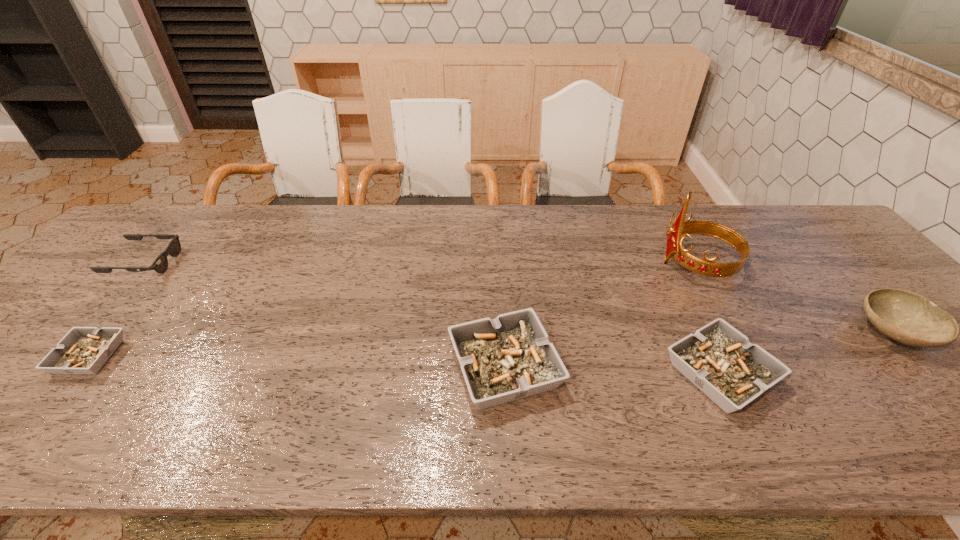
Image resolution: width=960 pixels, height=540 pixels. I want to click on object that is the second nearest to the fourth object from right to left, so click(x=680, y=228).

Select which ashtray appears as the closest to the leftmost ashtray. Please provide its 2D coordinates. Your answer should be formatted as a tuple, i.e. [(x, y)], where the tuple contains the x and y coordinates of a point satisfying the conditions above.

[(508, 358)]

You are a GUI agent. You are given a task and a screenshot of the screen. Output one action in this format:
    pyautogui.click(x=<x>, y=<y>)
    Task: Click on the ashtray that is the second closest to the fourth object from right to left
    Image resolution: width=960 pixels, height=540 pixels.
    Given the screenshot: What is the action you would take?
    pyautogui.click(x=83, y=350)

The height and width of the screenshot is (540, 960). Find the location of `free spot that satisfies the following two spatial constraints: 1. on the temples of the sunglasses; 2. on the back side of the second tallest ashtray`. free spot that satisfies the following two spatial constraints: 1. on the temples of the sunglasses; 2. on the back side of the second tallest ashtray is located at coordinates (48, 374).

Where is `free space that satisfies the following two spatial constraints: 1. on the front-facing side of the tiara; 2. on the front side of the second shortest ashtray`? Image resolution: width=960 pixels, height=540 pixels. free space that satisfies the following two spatial constraints: 1. on the front-facing side of the tiara; 2. on the front side of the second shortest ashtray is located at coordinates (759, 374).

Where is `vacant position in the image that satisfies the following two spatial constraints: 1. on the temples of the sunglasses; 2. on the back side of the shortest ashtray`? The image size is (960, 540). vacant position in the image that satisfies the following two spatial constraints: 1. on the temples of the sunglasses; 2. on the back side of the shortest ashtray is located at coordinates pos(62,357).

The width and height of the screenshot is (960, 540). I want to click on vacant region that satisfies the following two spatial constraints: 1. on the temples of the sunglasses; 2. on the right side of the shortest object, so click(x=62, y=357).